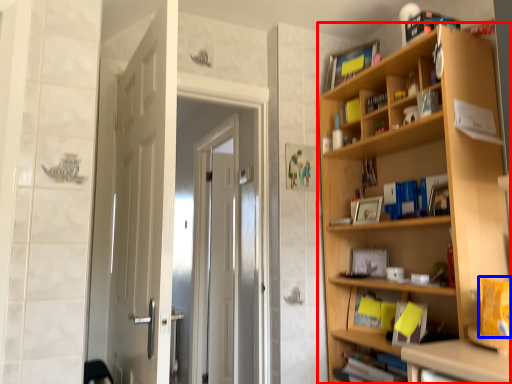
Question: Which point is further to the camera, bookcase (highlighted by a red box) or book (highlighted by a blue box)?

Choices:
 (A) bookcase
 (B) book

Answer: (A)